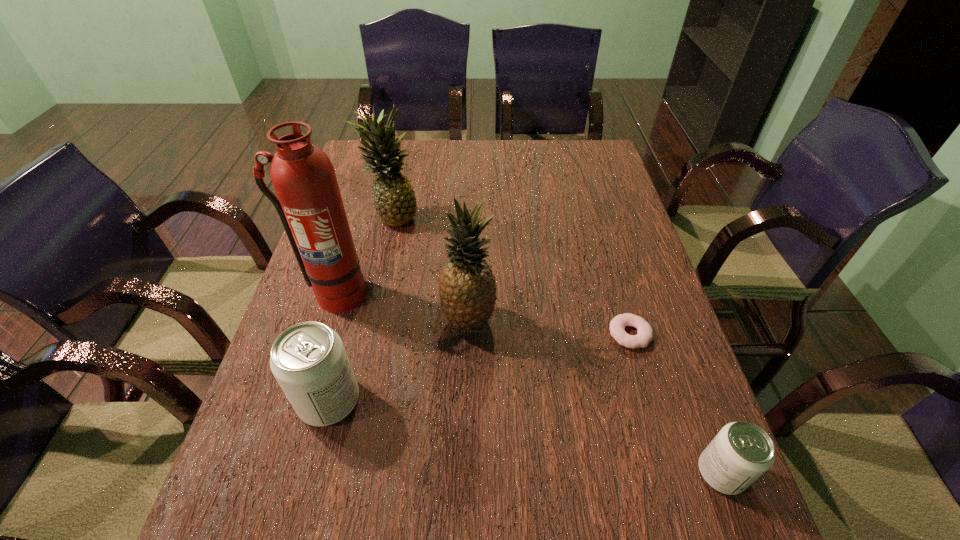
Where is `the third shortest object`? This screenshot has width=960, height=540. the third shortest object is located at coordinates (309, 361).

The height and width of the screenshot is (540, 960). In order to click on the farther soda can in this screenshot , I will do `click(309, 361)`.

Locate an element on the screen. This screenshot has width=960, height=540. the right soda can is located at coordinates (741, 452).

Where is `the nearest object`? This screenshot has height=540, width=960. the nearest object is located at coordinates (741, 452).

Find the location of a particular element. Image resolution: width=960 pixels, height=540 pixels. the left pineapple is located at coordinates (394, 200).

You are a GUI agent. You are given a task and a screenshot of the screen. Output one action in this format:
    pyautogui.click(x=<x>, y=<y>)
    Task: Click on the farthest object
    The height and width of the screenshot is (540, 960).
    Given the screenshot: What is the action you would take?
    pyautogui.click(x=394, y=200)

Image resolution: width=960 pixels, height=540 pixels. In order to click on the second object from right to left in this screenshot , I will do `click(644, 335)`.

You are a GUI agent. You are given a task and a screenshot of the screen. Output one action in this format:
    pyautogui.click(x=<x>, y=<y>)
    Task: Click on the shortest object
    The image size is (960, 540).
    Given the screenshot: What is the action you would take?
    pyautogui.click(x=644, y=335)

The height and width of the screenshot is (540, 960). Identify the location of the fourth object from left to right. (467, 289).

Where is `the nearer pineapple`? The width and height of the screenshot is (960, 540). the nearer pineapple is located at coordinates (467, 289).